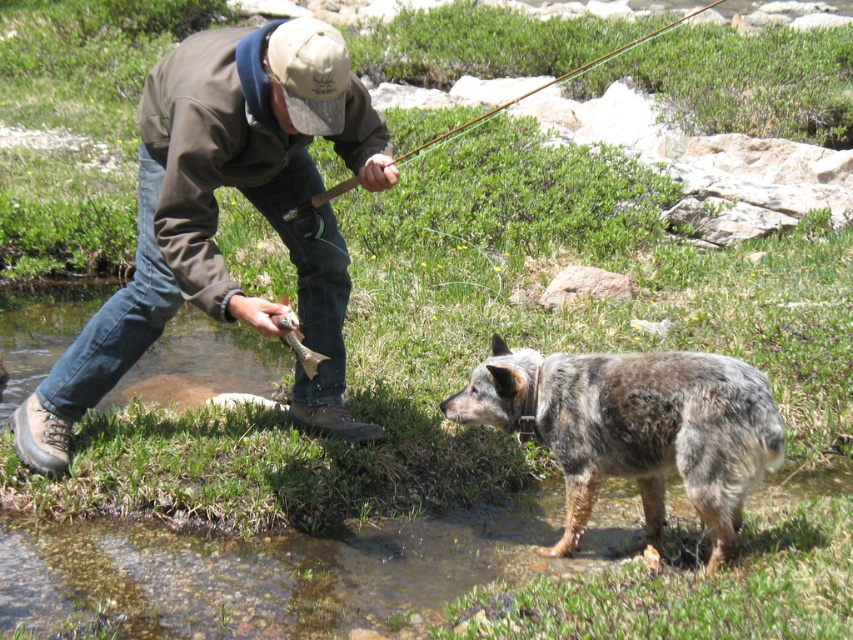
You are a photographer trying to capture the man and his dog in the scene. Since you want to focus on the man, you need to ensure the brown fleece jacket at center and the wooden fishing rod at upper center are in clear view. Which object should be positioned closer to the camera to achieve this focus?

The brown fleece jacket at center is closer to the viewer than the wooden fishing rod at upper center, so positioning the camera to focus on the jacket will naturally bring both into clear view as the jacket is already closer.

You are a photographer wanting to capture the wooden fishing rod at upper center and the shiny silver fish at center in the same frame. Since you want both objects to be clearly visible, which object should you focus on first to ensure proper focus given their sizes?

The wooden fishing rod at upper center is taller than the shiny silver fish at center, so focusing on the wooden fishing rod at upper center first would ensure proper focus since it occupies more space in the frame.

You are standing at the origin point of the coordinate system. You see a brown fleece jacket at center at point [218,216]. If you walk 0.1 units north, will you be closer to the jacket?

Yes, walking 0.1 units north from the origin point will bring you closer to the brown fleece jacket at center located at [218,216] because moving north increases the y coordinate, and the jacket is at a higher y coordinate than the origin.